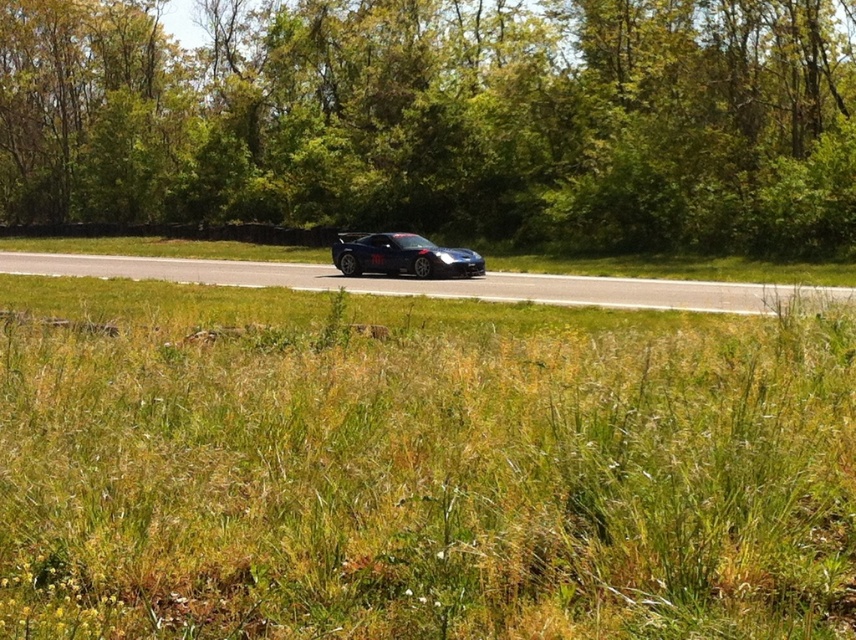
You are a pedestrian standing on the green grass at center. You want to cross the road to reach a path on the other side. Is the shiny blue car at center blocking your direct path?

The green grass at center is located below the shiny blue car at center, meaning the car is positioned over the grass. Therefore, the shiny blue car at center is blocking your direct path.

Consider the image. You are a photographer wanting to capture both the green leafy trees at center and the shiny blue car at center in your shot. Which object should you focus on first if you want to ensure both are in sharp focus?

The green leafy trees at center has a larger size compared to the shiny blue car at center, so focusing on the green leafy trees at center first will help ensure both are in sharp focus.

You are standing at the point marked by the coordinates [418,468] in the image. What is the name of the object located exactly at this point?

The green grass at center is located at point [418,468].